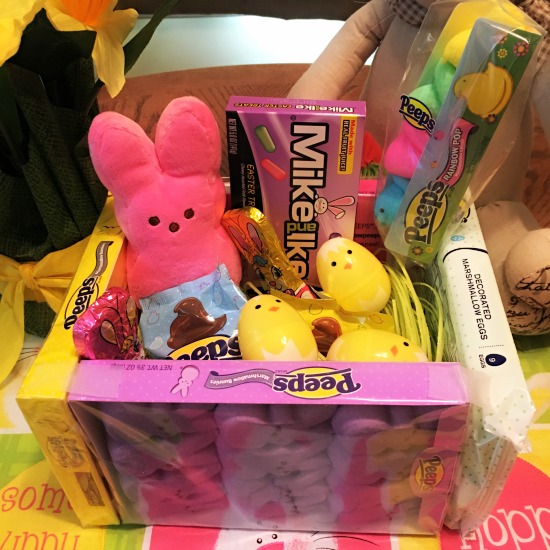
The width and height of the screenshot is (550, 550). Find the location of `stuffed animal`. stuffed animal is located at coordinates (176, 183).